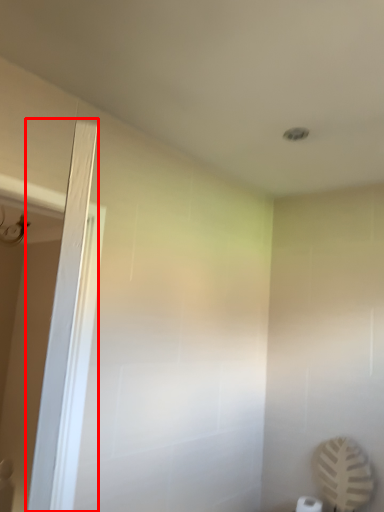
Question: Where is screen door (annotated by the red box) located in relation to toilet paper in the image?

Choices:
 (A) right
 (B) left

Answer: (B)